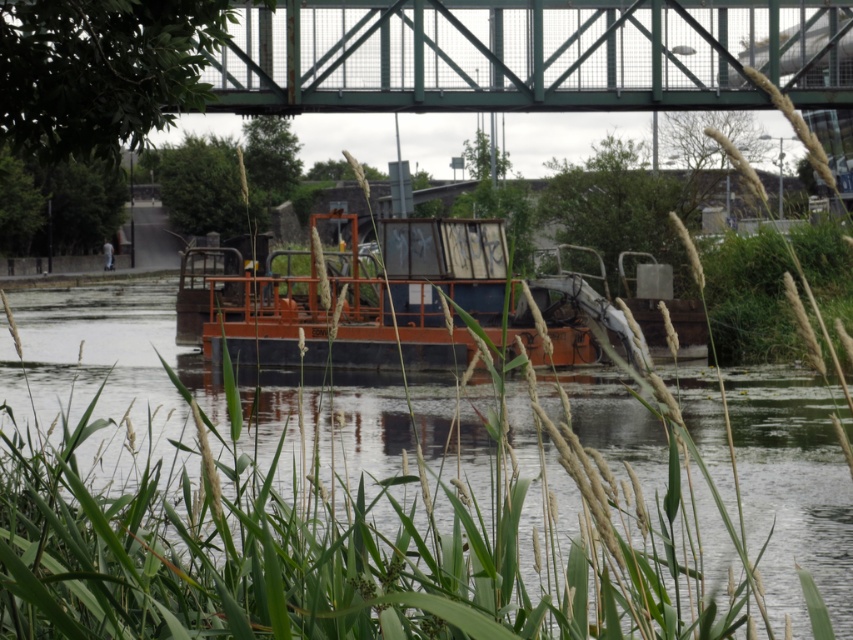
Question: Which point is farther from the camera taking this photo?

Choices:
 (A) (583, 80)
 (B) (618, 403)

Answer: (B)

Question: Does rusty metal barge at center appear on the right side of green metal bridge at upper center?

Choices:
 (A) yes
 (B) no

Answer: (B)

Question: From the image, what is the correct spatial relationship of rusty metal barge at center in relation to green metal bridge at upper center?

Choices:
 (A) above
 (B) below

Answer: (B)

Question: Is rusty metal barge at center thinner than green metal bridge at upper center?

Choices:
 (A) no
 (B) yes

Answer: (A)